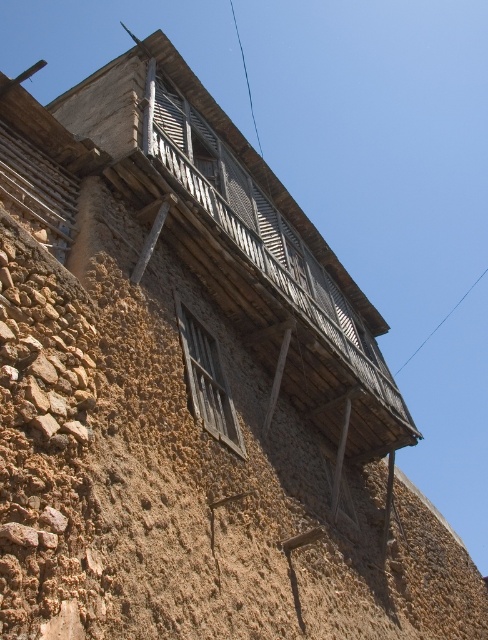
Who is taller, brown rough stone wall at center or wooden at upper center?

With more height is brown rough stone wall at center.

Is point (428, 580) farther from camera compared to point (197, 333)?

Yes.

What do you see at coordinates (187, 472) in the screenshot? I see `brown rough stone wall at center` at bounding box center [187, 472].

Where is `brown rough stone wall at center`? The height and width of the screenshot is (640, 488). brown rough stone wall at center is located at coordinates (187, 472).